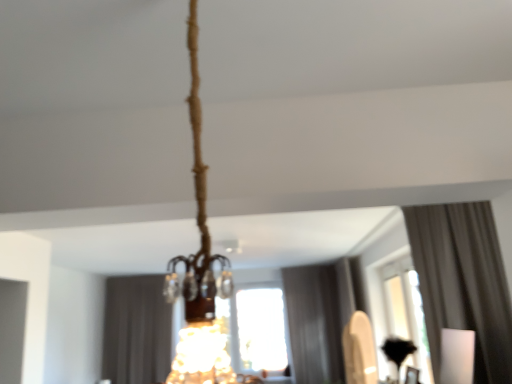
At what (x,y) coordinates should I click in order to perform the action: click on dark gray fabric curtain at center, which ranks as the 1th curtain in back-to-front order. Please return your answer as a coordinate pair (x, y). The image size is (512, 384). Looking at the image, I should click on (136, 330).

Describe the element at coordinates (136, 330) in the screenshot. I see `dark gray fabric curtain at center, arranged as the 3th curtain when viewed from the front` at that location.

At what (x,y) coordinates should I click in order to perform the action: click on gray fabric curtain at center, marked as the second curtain in a front-to-back arrangement. Please return your answer as a coordinate pair (x, y). Looking at the image, I should click on (321, 316).

This screenshot has height=384, width=512. What do you see at coordinates (463, 283) in the screenshot? I see `white fabric curtain at upper right, which is the third curtain from back to front` at bounding box center [463, 283].

Locate an element on the screen. dark gray fabric curtain at center, acting as the third curtain starting from the right is located at coordinates (136, 330).

Is white fabric curtain at upper right, the 1th curtain in the front-to-back sequence, facing away from gray fabric curtain at center, acting as the second curtain starting from the back?

No.

From the image's perspective, between white fabric curtain at upper right, which is counted as the third curtain, starting from the left, and gray fabric curtain at center, marked as the second curtain in a front-to-back arrangement, which one is located above?

white fabric curtain at upper right, which is counted as the third curtain, starting from the left.

What's the angular difference between white fabric curtain at upper right, the 1th curtain in the front-to-back sequence, and gray fabric curtain at center, acting as the second curtain starting from the back,'s facing directions?

white fabric curtain at upper right, the 1th curtain in the front-to-back sequence, and gray fabric curtain at center, acting as the second curtain starting from the back, are facing 90 degrees away from each other.

Is transparent glass window at center not within white fabric curtain at upper right, which is the third curtain from back to front?

Yes, transparent glass window at center is not within white fabric curtain at upper right, which is the third curtain from back to front.

From a real-world perspective, is transparent glass window at center on white fabric curtain at upper right, the first curtain from the right?

Incorrect, from a real-world perspective, transparent glass window at center is lower than white fabric curtain at upper right, the first curtain from the right.

Can you confirm if transparent glass window at center is bigger than white fabric curtain at upper right, the 1th curtain in the front-to-back sequence?

Actually, transparent glass window at center might be smaller than white fabric curtain at upper right, the 1th curtain in the front-to-back sequence.

In the image, is transparent glass window at center on the left side or the right side of white fabric curtain at upper right, the first curtain from the right?

From the image, it's evident that transparent glass window at center is to the right of white fabric curtain at upper right, the first curtain from the right.

Measure the distance between gray fabric curtain at center, marked as the second curtain in a front-to-back arrangement, and dark gray fabric curtain at center, arranged as the 3th curtain when viewed from the front.

2.09 meters.

Is gray fabric curtain at center, acting as the second curtain starting from the back, positioned in front of dark gray fabric curtain at center, the first curtain when ordered from left to right?

Yes.

Is gray fabric curtain at center, which is counted as the second curtain, starting from the left, aimed at dark gray fabric curtain at center, which ranks as the 1th curtain in back-to-front order?

No, gray fabric curtain at center, which is counted as the second curtain, starting from the left, does not turn towards dark gray fabric curtain at center, which ranks as the 1th curtain in back-to-front order.

Is gray fabric curtain at center, acting as the second curtain starting from the back, completely or partially outside of dark gray fabric curtain at center, which ranks as the 1th curtain in back-to-front order?

Yes.

Does dark gray fabric curtain at center, acting as the third curtain starting from the right, turn towards transparent glass window at center?

No, dark gray fabric curtain at center, acting as the third curtain starting from the right, is not facing towards transparent glass window at center.

Are dark gray fabric curtain at center, acting as the third curtain starting from the right, and transparent glass window at center far apart?

Yes.

Considering the relative sizes of dark gray fabric curtain at center, acting as the third curtain starting from the right, and transparent glass window at center in the image provided, is dark gray fabric curtain at center, acting as the third curtain starting from the right, shorter than transparent glass window at center?

No, dark gray fabric curtain at center, acting as the third curtain starting from the right, is not shorter than transparent glass window at center.

Could you tell me if gray fabric curtain at center, which is counted as the second curtain, starting from the left, is facing transparent glass window at center?

No, gray fabric curtain at center, which is counted as the second curtain, starting from the left, is not facing towards transparent glass window at center.

Is transparent glass window at center a part of gray fabric curtain at center, acting as the 2th curtain starting from the right?

No.

Is gray fabric curtain at center, acting as the 2th curtain starting from the right, shorter than transparent glass window at center?

No.

Between point (312, 369) and point (391, 256), which one is positioned behind?

Point (312, 369)

The height and width of the screenshot is (384, 512). In the image, there is a dark gray fabric curtain at center, arranged as the 3th curtain when viewed from the front. Identify the location of window below it (from a real-world perspective). (399, 307).

Which is in front, point (393, 274) or point (110, 348)?

The point (393, 274) is closer to the camera.

In terms of size, does white fabric curtain at upper right, which is the third curtain from back to front, appear bigger or smaller than transparent glass window at center?

white fabric curtain at upper right, which is the third curtain from back to front, is bigger than transparent glass window at center.

From the image's perspective, does white fabric curtain at upper right, which is the third curtain from back to front, appear lower than transparent glass window at center?

No.

From a real-world perspective, which object stands above the other?

white fabric curtain at upper right, the 1th curtain in the front-to-back sequence, from a real-world perspective.

Which object is thinner, white fabric curtain at upper right, which is the third curtain from back to front, or transparent glass window at center?

transparent glass window at center is thinner.

From the white fabric curtain at upper right, the 1th curtain in the front-to-back sequence, count the 1st curtain to the left and point to it. Please provide its 2D coordinates.

[(321, 316)]

The height and width of the screenshot is (384, 512). I want to click on window located on the right of white fabric curtain at upper right, which is the third curtain from back to front, so click(x=399, y=307).

Estimate the real-world distances between objects in this image. Which object is closer to gray fabric curtain at center, acting as the second curtain starting from the back, white fabric curtain at upper right, the 1th curtain in the front-to-back sequence, or dark gray fabric curtain at center, arranged as the 3th curtain when viewed from the front?

dark gray fabric curtain at center, arranged as the 3th curtain when viewed from the front.

When comparing their distances from white fabric curtain at upper right, the first curtain from the right, does transparent glass window at center or dark gray fabric curtain at center, the first curtain when ordered from left to right, seem closer?

transparent glass window at center is positioned closer to the anchor white fabric curtain at upper right, the first curtain from the right.

Looking at this image, considering their positions, is dark gray fabric curtain at center, the first curtain when ordered from left to right, positioned further to transparent glass window at center than gray fabric curtain at center, which is counted as the second curtain, starting from the left?

dark gray fabric curtain at center, the first curtain when ordered from left to right, is further to transparent glass window at center.

Looking at the image, which one is located closer to transparent glass window at center, gray fabric curtain at center, acting as the second curtain starting from the back, or white fabric curtain at upper right, which is the third curtain from back to front?

Among the two, gray fabric curtain at center, acting as the second curtain starting from the back, is located nearer to transparent glass window at center.

Estimate the real-world distances between objects in this image. Which object is further from transparent glass window at center, white fabric curtain at upper right, the first curtain from the right, or gray fabric curtain at center, which is counted as the second curtain, starting from the left?

Among the two, white fabric curtain at upper right, the first curtain from the right, is located further to transparent glass window at center.

Which object lies further to the anchor point gray fabric curtain at center, acting as the second curtain starting from the back, white fabric curtain at upper right, which is the third curtain from back to front, or transparent glass window at center?

white fabric curtain at upper right, which is the third curtain from back to front, is further to gray fabric curtain at center, acting as the second curtain starting from the back.

From the image, which object appears to be nearer to white fabric curtain at upper right, the first curtain from the right, gray fabric curtain at center, which is counted as the second curtain, starting from the left, or dark gray fabric curtain at center, acting as the third curtain starting from the right?

Among the two, gray fabric curtain at center, which is counted as the second curtain, starting from the left, is located nearer to white fabric curtain at upper right, the first curtain from the right.

Based on their spatial positions, is dark gray fabric curtain at center, which ranks as the 1th curtain in back-to-front order, or gray fabric curtain at center, which is counted as the second curtain, starting from the left, closer to white fabric curtain at upper right, the first curtain from the right?

Among the two, gray fabric curtain at center, which is counted as the second curtain, starting from the left, is located nearer to white fabric curtain at upper right, the first curtain from the right.

Locate an element on the screen. Image resolution: width=512 pixels, height=384 pixels. window positioned between white fabric curtain at upper right, the 1th curtain in the front-to-back sequence, and dark gray fabric curtain at center, the first curtain when ordered from left to right, from near to far is located at coordinates (399, 307).

The image size is (512, 384). In order to click on window between white fabric curtain at upper right, the first curtain from the right, and gray fabric curtain at center, acting as the 2th curtain starting from the right, from front to back in this screenshot , I will do `click(399, 307)`.

Identify the location of curtain located between white fabric curtain at upper right, which is counted as the third curtain, starting from the left, and dark gray fabric curtain at center, arranged as the 3th curtain when viewed from the front, in the depth direction. The height and width of the screenshot is (384, 512). (321, 316).